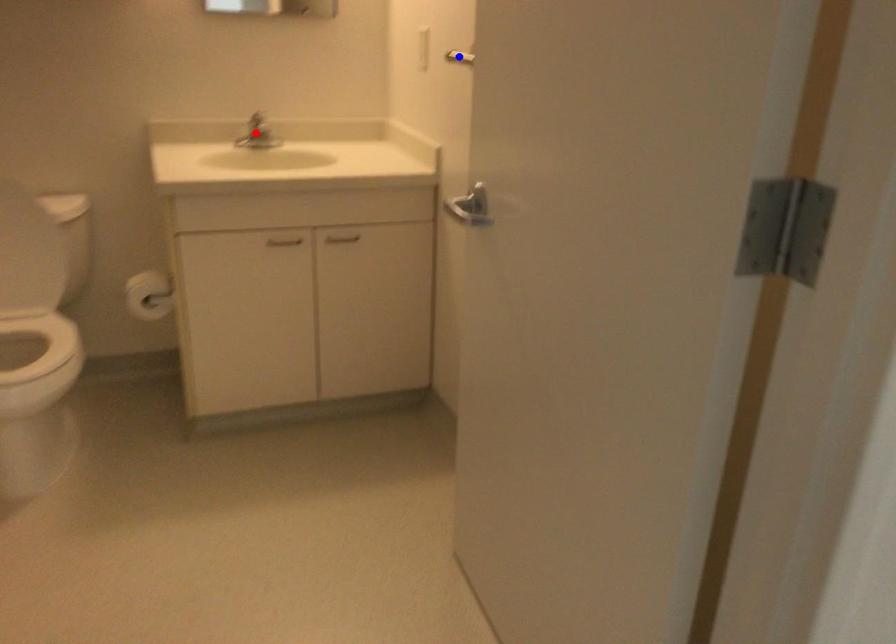
Question: Two points are marked on the image. Which point is closer to the camera?

Choices:
 (A) Blue point is closer.
 (B) Red point is closer.

Answer: (A)